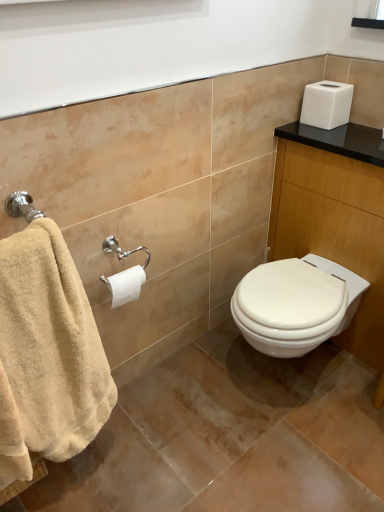
In order to click on white matte toilet paper at center left in this screenshot , I will do `click(126, 285)`.

Locate an element on the screen. The width and height of the screenshot is (384, 512). beige cotton towel at left is located at coordinates (47, 354).

Which of these two, white glossy vanity at upper right or white matte toilet paper at center left, is wider?

With larger width is white glossy vanity at upper right.

Who is smaller, white glossy vanity at upper right or white matte toilet paper at center left?

white matte toilet paper at center left is smaller.

Which of these two, white glossy vanity at upper right or white matte toilet paper at center left, stands shorter?

With less height is white matte toilet paper at center left.

Based on the photo, does white glossy vanity at upper right appear on the left side of white matte toilet paper at center left?

No, white glossy vanity at upper right is not to the left of white matte toilet paper at center left.

Is point (131, 284) positioned before point (280, 170)?

Yes, it is.

Consider the image. Can you confirm if white matte toilet paper at center left is positioned to the left of white glossy vanity at upper right?

Yes.

Is white matte toilet paper at center left turned away from white glossy vanity at upper right?

white matte toilet paper at center left is not turned away from white glossy vanity at upper right.

Is point (58, 381) positioned after point (378, 335)?

That is False.

Which is more to the right, beige cotton towel at left or white glossy vanity at upper right?

Positioned to the right is white glossy vanity at upper right.

Which object is further away from the camera, beige cotton towel at left or white glossy vanity at upper right?

white glossy vanity at upper right is behind.

From a real-world perspective, which is physically below, beige cotton towel at left or white glossy vanity at upper right?

white glossy vanity at upper right, from a real-world perspective.

Considering the sizes of objects beige cotton towel at left and white matte toilet paper at center left in the image provided, who is shorter, beige cotton towel at left or white matte toilet paper at center left?

With less height is white matte toilet paper at center left.

Which point is more forward, (17, 284) or (132, 287)?

The point (17, 284) is closer to the camera.

Locate an element on the screen. towel below the white matte toilet paper at center left (from a real-world perspective) is located at coordinates (47, 354).

Is beige cotton towel at left far away from white matte toilet paper at center left?

beige cotton towel at left is near white matte toilet paper at center left, not far away.

Based on the photo, from the image's perspective, which object appears higher, white glossy vanity at upper right or beige cotton towel at left?

white glossy vanity at upper right.

Measure the distance between white glossy vanity at upper right and beige cotton towel at left.

white glossy vanity at upper right and beige cotton towel at left are 1.12 meters apart from each other.

Considering their positions, is white glossy vanity at upper right located in front of or behind beige cotton towel at left?

Visually, white glossy vanity at upper right is located behind beige cotton towel at left.

Looking at this image, from a real-world perspective, which object rests below the other?

beige cotton towel at left is physically lower.

Is white matte toilet paper at center left positioned with its back to beige cotton towel at left?

No, beige cotton towel at left is not at the back of white matte toilet paper at center left.

Is white matte toilet paper at center left far from beige cotton towel at left?

No, white matte toilet paper at center left is not far away from beige cotton towel at left.

Who is shorter, white matte toilet paper at center left or beige cotton towel at left?

white matte toilet paper at center left.

Find the location of a particular element. This screenshot has height=512, width=384. toilet paper that is on the left side of white glossy vanity at upper right is located at coordinates (126, 285).

You are a GUI agent. You are given a task and a screenshot of the screen. Output one action in this format:
    pyautogui.click(x=<x>, y=<y>)
    Task: Click on the toilet paper below the white glossy vanity at upper right (from the image's perspective)
    This screenshot has width=384, height=512.
    Given the screenshot: What is the action you would take?
    pyautogui.click(x=126, y=285)

Looking at the image, which one is located closer to beige cotton towel at left, white glossy vanity at upper right or white matte toilet paper at center left?

white matte toilet paper at center left is closer to beige cotton towel at left.

Estimate the real-world distances between objects in this image. Which object is further from white glossy vanity at upper right, white matte toilet paper at center left or beige cotton towel at left?

The object further to white glossy vanity at upper right is beige cotton towel at left.

Based on their spatial positions, is beige cotton towel at left or white matte toilet paper at center left closer to white glossy vanity at upper right?

The object closer to white glossy vanity at upper right is white matte toilet paper at center left.

Estimate the real-world distances between objects in this image. Which object is further from white matte toilet paper at center left, beige cotton towel at left or white glossy vanity at upper right?

white glossy vanity at upper right lies further to white matte toilet paper at center left than the other object.

Which object lies nearer to the anchor point beige cotton towel at left, white matte toilet paper at center left or white glossy vanity at upper right?

white matte toilet paper at center left is positioned closer to the anchor beige cotton towel at left.

Which object lies nearer to the anchor point white matte toilet paper at center left, white glossy vanity at upper right or beige cotton towel at left?

beige cotton towel at left.

At what (x,y) coordinates should I click in order to perform the action: click on toilet paper between beige cotton towel at left and white glossy vanity at upper right from left to right. Please return your answer as a coordinate pair (x, y). Image resolution: width=384 pixels, height=512 pixels. Looking at the image, I should click on (126, 285).